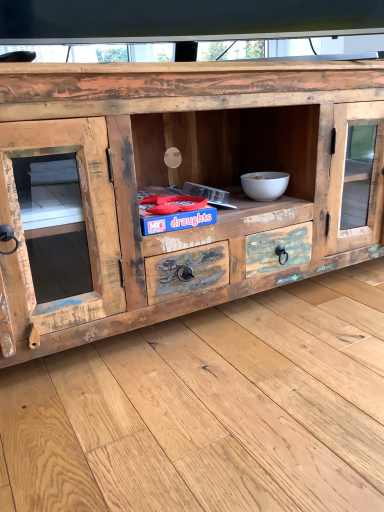
Describe the element at coordinates (182, 181) in the screenshot. This screenshot has width=384, height=512. I see `rustic wood chest of drawers at center` at that location.

Where is `rustic wood chest of drawers at center`? rustic wood chest of drawers at center is located at coordinates (182, 181).

The width and height of the screenshot is (384, 512). Identify the location of white matte bowl at center-right. (265, 185).

Image resolution: width=384 pixels, height=512 pixels. What do you see at coordinates (265, 185) in the screenshot?
I see `white matte bowl at center-right` at bounding box center [265, 185].

Locate an element on the screen. This screenshot has width=384, height=512. rustic wood chest of drawers at center is located at coordinates (182, 181).

Considering the positions of objects white matte bowl at center-right and rustic wood chest of drawers at center in the image provided, who is more to the left, white matte bowl at center-right or rustic wood chest of drawers at center?

From the viewer's perspective, rustic wood chest of drawers at center appears more on the left side.

Which object is closer to the camera taking this photo, white matte bowl at center-right or rustic wood chest of drawers at center?

rustic wood chest of drawers at center is more forward.

Between point (255, 183) and point (231, 70), which one is positioned behind?

The point (255, 183) is farther from the camera.

From the image's perspective, which one is positioned higher, white matte bowl at center-right or rustic wood chest of drawers at center?

rustic wood chest of drawers at center, from the image's perspective.

From a real-world perspective, who is located lower, white matte bowl at center-right or rustic wood chest of drawers at center?

white matte bowl at center-right is physically lower.

Is white matte bowl at center-right wider or thinner than rustic wood chest of drawers at center?

Clearly, white matte bowl at center-right has less width compared to rustic wood chest of drawers at center.

From the picture: Does white matte bowl at center-right have a lesser height compared to rustic wood chest of drawers at center?

Yes, white matte bowl at center-right is shorter than rustic wood chest of drawers at center.

Can you confirm if white matte bowl at center-right is smaller than rustic wood chest of drawers at center?

Yes, white matte bowl at center-right is smaller than rustic wood chest of drawers at center.

Is rustic wood chest of drawers at center completely or partially inside white matte bowl at center-right?

Actually, rustic wood chest of drawers at center is outside white matte bowl at center-right.

Is white matte bowl at center-right in contact with rustic wood chest of drawers at center?

No, white matte bowl at center-right is not with rustic wood chest of drawers at center.

Could you tell me if white matte bowl at center-right is facing rustic wood chest of drawers at center?

Yes, white matte bowl at center-right is aimed at rustic wood chest of drawers at center.

Can you tell me how much white matte bowl at center-right and rustic wood chest of drawers at center differ in facing direction?

white matte bowl at center-right and rustic wood chest of drawers at center are facing 0.628 degrees away from each other.

This screenshot has height=512, width=384. What are the coordinates of `bowl below the rustic wood chest of drawers at center (from a real-world perspective)` in the screenshot? It's located at (265, 185).

Does rustic wood chest of drawers at center appear on the right side of white matte bowl at center-right?

No, rustic wood chest of drawers at center is not to the right of white matte bowl at center-right.

Looking at this image, considering the positions of objects rustic wood chest of drawers at center and white matte bowl at center-right in the image provided, who is behind, rustic wood chest of drawers at center or white matte bowl at center-right?

white matte bowl at center-right is further from the camera.

Considering the positions of point (173, 95) and point (277, 184), is point (173, 95) closer or farther from the camera than point (277, 184)?

Point (173, 95).

From the image's perspective, is rustic wood chest of drawers at center under white matte bowl at center-right?

Actually, rustic wood chest of drawers at center appears above white matte bowl at center-right in the image.

From a real-world perspective, is rustic wood chest of drawers at center physically located above or below white matte bowl at center-right?

rustic wood chest of drawers at center is situated higher than white matte bowl at center-right in the real world.

Looking at their sizes, would you say rustic wood chest of drawers at center is wider or thinner than white matte bowl at center-right?

Considering their sizes, rustic wood chest of drawers at center looks broader than white matte bowl at center-right.

Can you confirm if rustic wood chest of drawers at center is shorter than white matte bowl at center-right?

Incorrect, the height of rustic wood chest of drawers at center does not fall short of that of white matte bowl at center-right.

Considering the sizes of objects rustic wood chest of drawers at center and white matte bowl at center-right in the image provided, who is bigger, rustic wood chest of drawers at center or white matte bowl at center-right?

rustic wood chest of drawers at center.

Is white matte bowl at center-right completely or partially inside rustic wood chest of drawers at center?

Indeed, white matte bowl at center-right is located within rustic wood chest of drawers at center.

Is there a large distance between rustic wood chest of drawers at center and white matte bowl at center-right?

No, rustic wood chest of drawers at center is not far from white matte bowl at center-right.

Is rustic wood chest of drawers at center facing away from white matte bowl at center-right?

Yes, rustic wood chest of drawers at center is positioned with its back facing white matte bowl at center-right.

How far apart are rustic wood chest of drawers at center and white matte bowl at center-right?

rustic wood chest of drawers at center is 12.30 inches away from white matte bowl at center-right.

Find the location of a particular element. The image size is (384, 512). the chest of drawers in front of the white matte bowl at center-right is located at coordinates (182, 181).

The image size is (384, 512). Identify the location of bowl below the rustic wood chest of drawers at center (from a real-world perspective). (265, 185).

Identify the location of the chest of drawers in front of the white matte bowl at center-right. The image size is (384, 512). (182, 181).